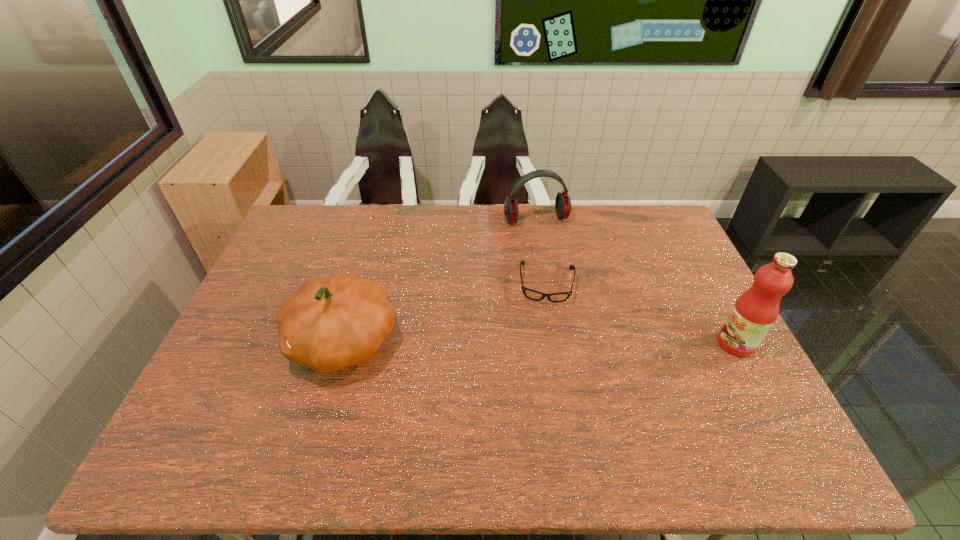
Where is `object located in the near left corner section of the desktop`? object located in the near left corner section of the desktop is located at coordinates (330, 323).

Identify the location of free point at the far edge. This screenshot has width=960, height=540. (448, 213).

This screenshot has width=960, height=540. I want to click on vacant space at the near edge of the desktop, so click(x=474, y=415).

The width and height of the screenshot is (960, 540). In the image, there is a desktop. Find the location of `free space at the left edge`. free space at the left edge is located at coordinates (277, 273).

Find the location of `vacant space at the right edge`. vacant space at the right edge is located at coordinates (676, 279).

The height and width of the screenshot is (540, 960). I want to click on free space at the far left corner of the desktop, so click(295, 212).

Locate an element on the screen. This screenshot has height=540, width=960. vacant space at the far right corner of the desktop is located at coordinates click(629, 213).

You are a GUI agent. You are given a task and a screenshot of the screen. Output one action in this format:
    pyautogui.click(x=<x>, y=<y>)
    Task: Click on the free space that is in between the fruit juice and the third tallest object
    This screenshot has height=540, width=960.
    Given the screenshot: What is the action you would take?
    pyautogui.click(x=636, y=282)

Image resolution: width=960 pixels, height=540 pixels. I want to click on vacant area between the third tallest object and the spectacles, so click(541, 252).

What are the coordinates of `blank region between the tallest object and the farthest object` in the screenshot? It's located at (636, 282).